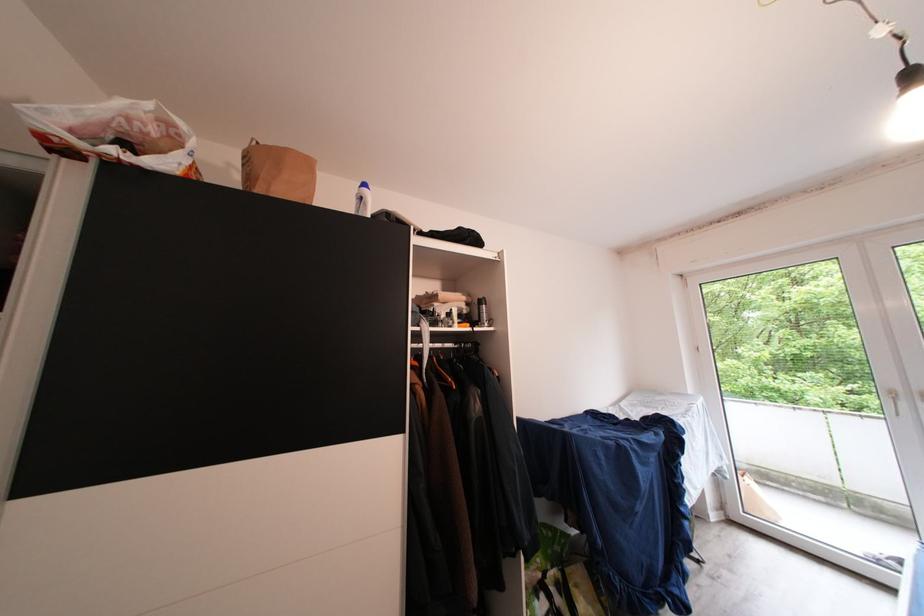
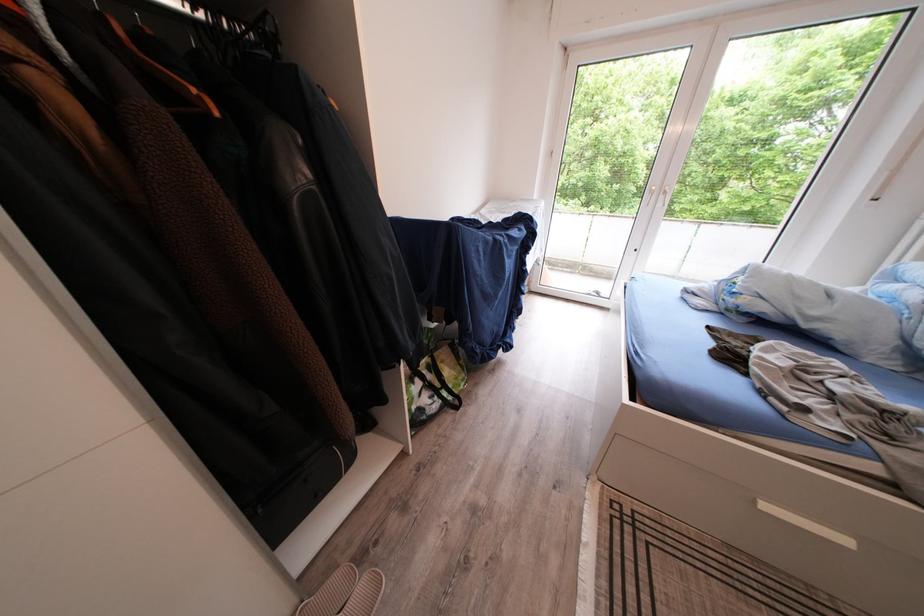
Find the pixel in the second image that matches (x=466, y=352) in the first image.

(210, 21)